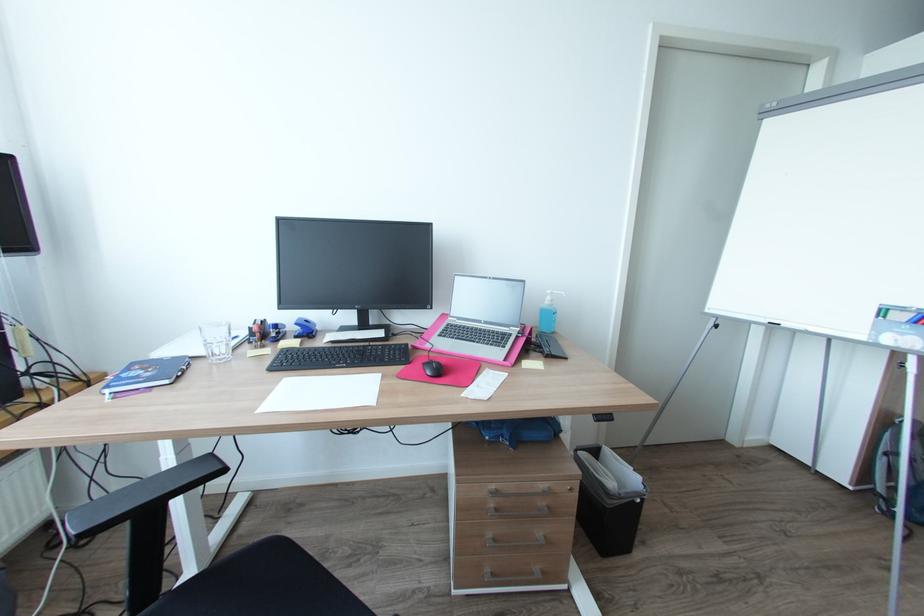
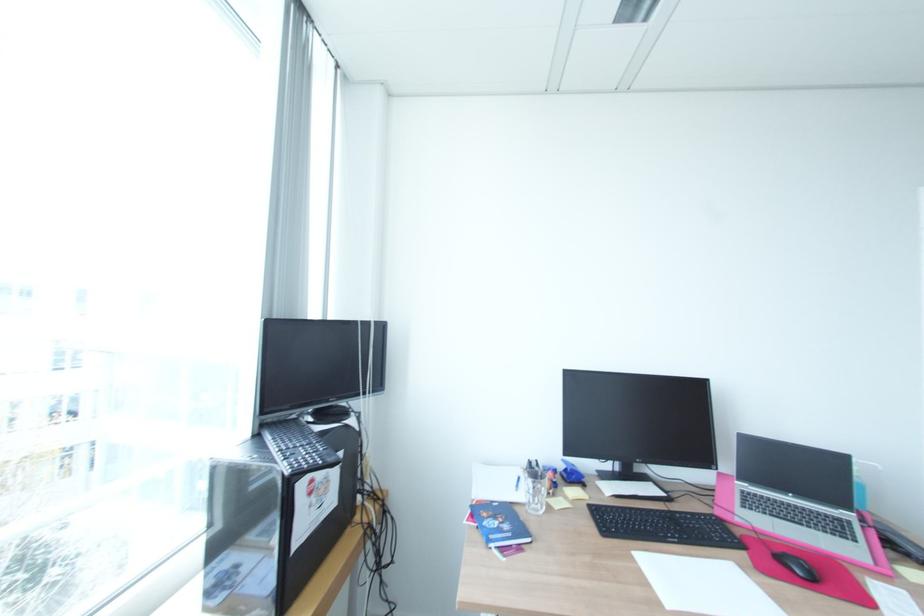
Locate, in the second image, the point that corresponds to pixel 140 377 in the first image.

(504, 530)